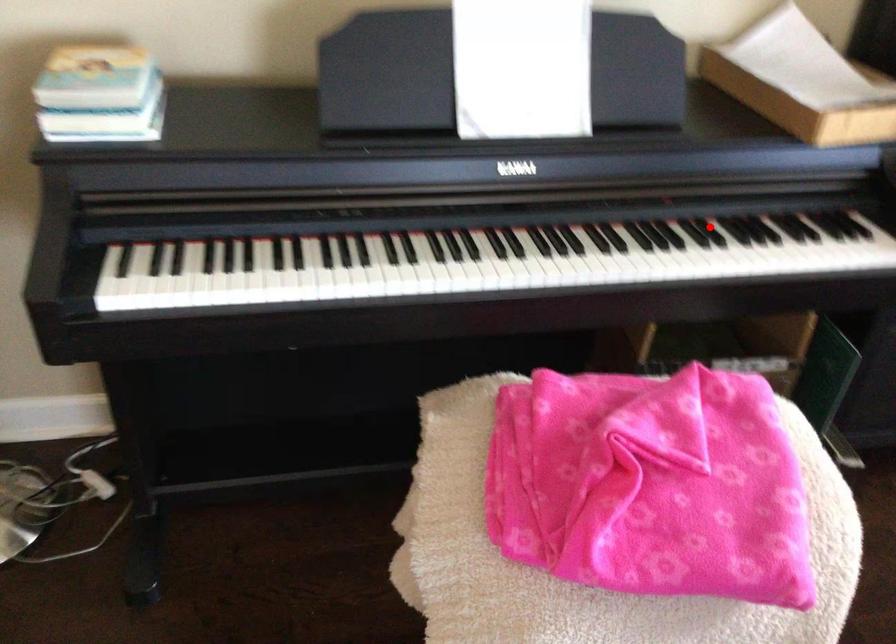
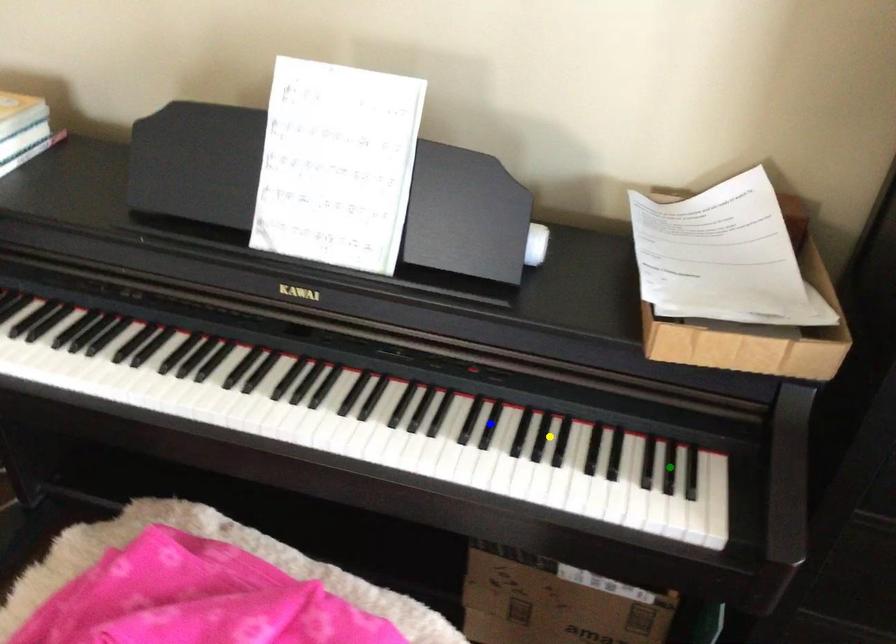
Question: I am providing you with two images of the same scene from different viewpoints. A red point is marked on the first image. You are given multiple points on the second image. Which point in image 2 is actually the same real-world point as the red point in image 1?

Choices:
 (A) yellow point
 (B) green point
 (C) blue point

Answer: (C)